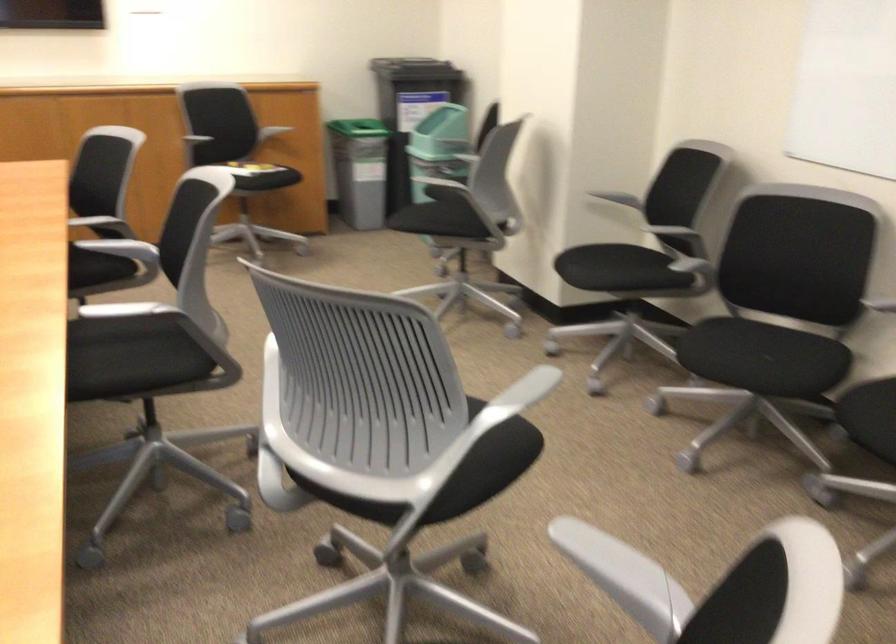
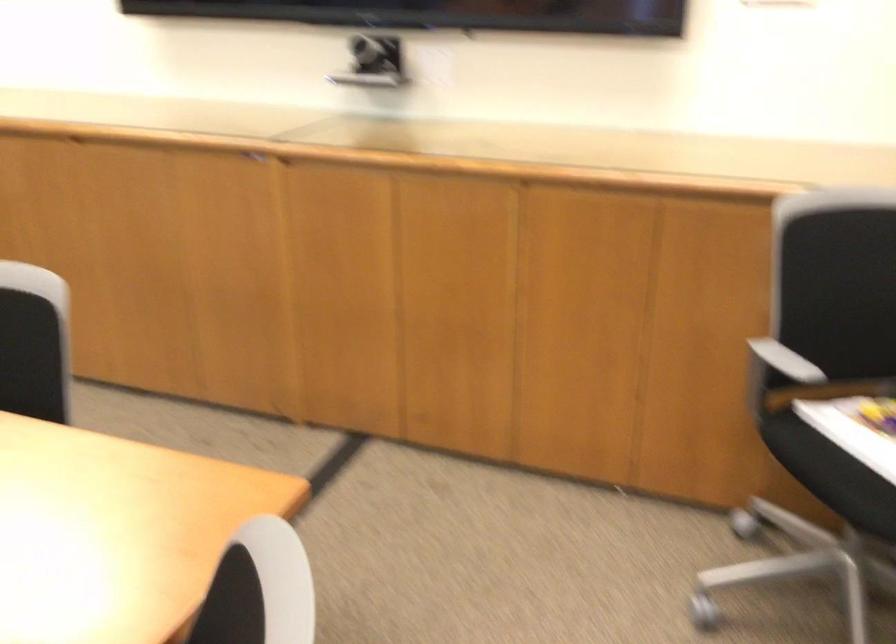
The point at (236, 152) is marked in the first image. Where is the corresponding point in the second image?

(857, 442)